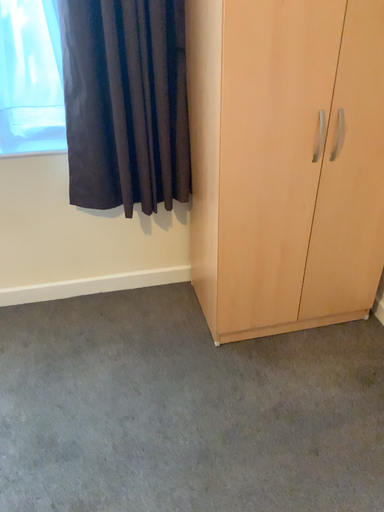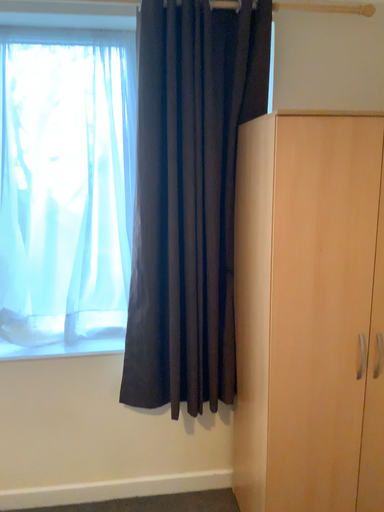
Question: Which way did the camera rotate in the video?

Choices:
 (A) rotated downward
 (B) rotated upward

Answer: (B)